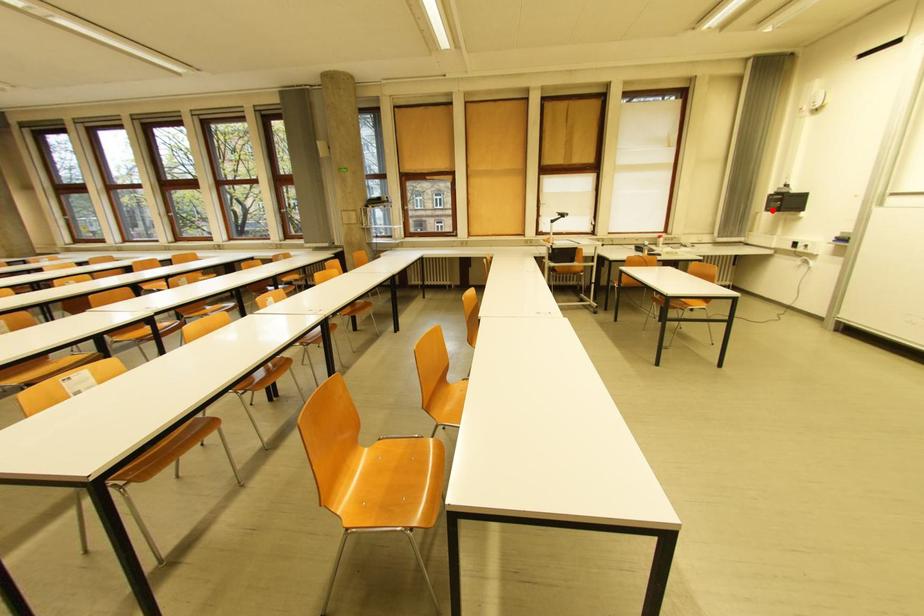
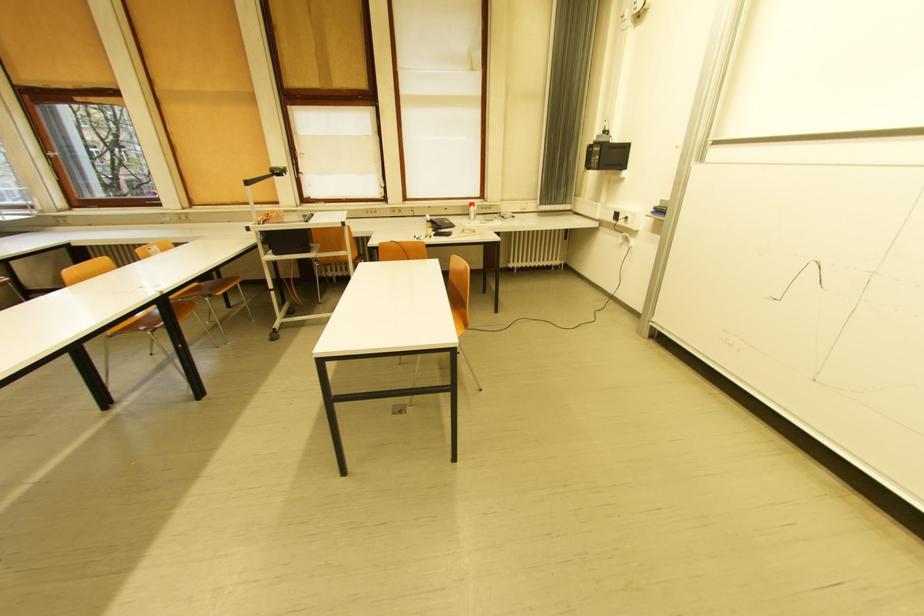
Question: I am providing you with two images of the same scene from different viewpoints. In image1, a red point is highlighted. Considering the same 3D point in image2, which of the following is correct?

Choices:
 (A) It is closer
 (B) It is farther

Answer: (A)